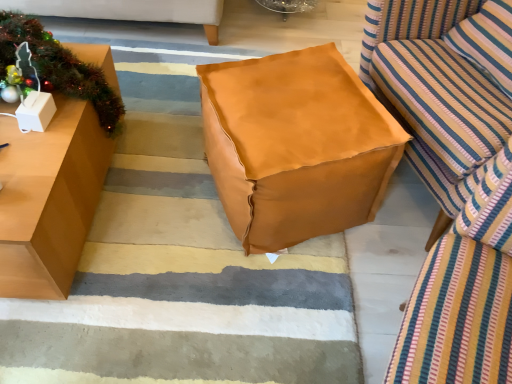
Question: From the image's perspective, is brown leather ottoman at center located beneath white cardboard box at left?

Choices:
 (A) yes
 (B) no

Answer: (A)

Question: From a real-world perspective, is brown leather ottoman at center positioned under white cardboard box at left based on gravity?

Choices:
 (A) yes
 (B) no

Answer: (A)

Question: From a real-world perspective, is brown leather ottoman at center on white cardboard box at left?

Choices:
 (A) no
 (B) yes

Answer: (A)

Question: Is brown leather ottoman at center behind white cardboard box at left?

Choices:
 (A) yes
 (B) no

Answer: (B)

Question: Is brown leather ottoman at center thinner than white cardboard box at left?

Choices:
 (A) yes
 (B) no

Answer: (B)

Question: Looking at their shapes, would you say striped fabric pillow at right is wider or thinner than brown leather ottoman at center?

Choices:
 (A) wide
 (B) thin

Answer: (B)

Question: Relative to brown leather ottoman at center, is striped fabric pillow at right in front or behind?

Choices:
 (A) front
 (B) behind

Answer: (B)

Question: From the image's perspective, is striped fabric pillow at right located above or below brown leather ottoman at center?

Choices:
 (A) below
 (B) above

Answer: (B)

Question: Is point (510, 56) positioned closer to the camera than point (302, 360)?

Choices:
 (A) farther
 (B) closer

Answer: (A)

Question: Is leather-like tan bean bag at center inside the boundaries of metallic green garland at left, or outside?

Choices:
 (A) inside
 (B) outside

Answer: (B)

Question: Is leather-like tan bean bag at center in front of or behind metallic green garland at left in the image?

Choices:
 (A) front
 (B) behind

Answer: (A)

Question: Considering the positions of leather-like tan bean bag at center and metallic green garland at left in the image, is leather-like tan bean bag at center wider or thinner than metallic green garland at left?

Choices:
 (A) thin
 (B) wide

Answer: (B)

Question: From their relative heights in the image, would you say leather-like tan bean bag at center is taller or shorter than metallic green garland at left?

Choices:
 (A) tall
 (B) short

Answer: (B)

Question: Is white cardboard box at left wider or thinner than striped fabric studio couch at right?

Choices:
 (A) wide
 (B) thin

Answer: (B)

Question: In terms of height, does white cardboard box at left look taller or shorter compared to striped fabric studio couch at right?

Choices:
 (A) short
 (B) tall

Answer: (A)